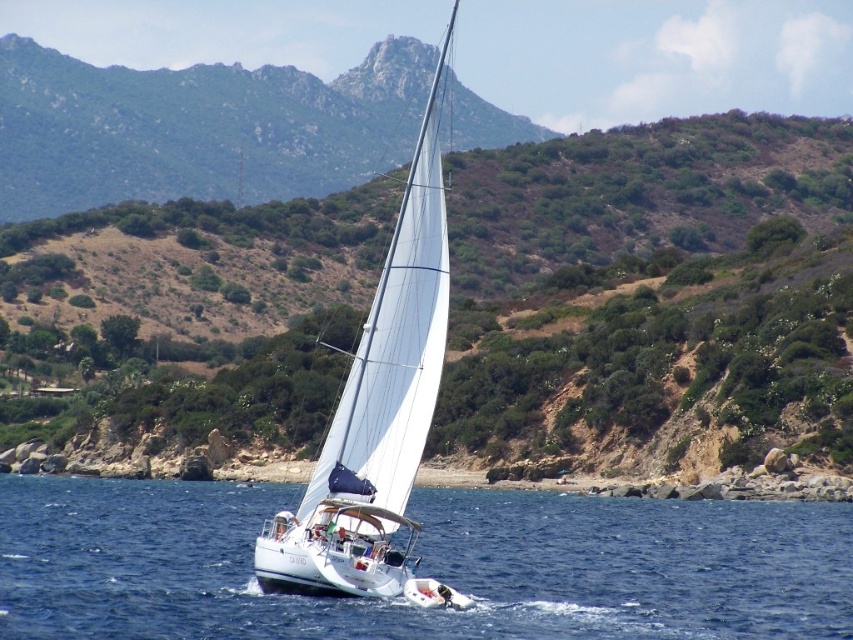
Can you confirm if green shrubbery at center is shorter than blue water at center?

No.

Is green shrubbery at center wider than blue water at center?

Indeed, green shrubbery at center has a greater width compared to blue water at center.

Locate an element on the screen. The image size is (853, 640). green shrubbery at center is located at coordinates (651, 300).

This screenshot has height=640, width=853. In order to click on green shrubbery at center in this screenshot , I will do `click(651, 300)`.

Which is below, blue water at center or white sailboat at center?

blue water at center is lower down.

Describe the element at coordinates (421, 564) in the screenshot. The width and height of the screenshot is (853, 640). I see `blue water at center` at that location.

Image resolution: width=853 pixels, height=640 pixels. I want to click on blue water at center, so click(421, 564).

Based on the photo, is green shrubbery at center to the left of white sailboat at center from the viewer's perspective?

In fact, green shrubbery at center is to the right of white sailboat at center.

Which is more to the left, green shrubbery at center or white sailboat at center?

white sailboat at center

You are a GUI agent. You are given a task and a screenshot of the screen. Output one action in this format:
    pyautogui.click(x=<x>, y=<y>)
    Task: Click on the green shrubbery at center
    The height and width of the screenshot is (640, 853).
    Given the screenshot: What is the action you would take?
    pyautogui.click(x=651, y=300)

You are a GUI agent. You are given a task and a screenshot of the screen. Output one action in this format:
    pyautogui.click(x=<x>, y=<y>)
    Task: Click on the green shrubbery at center
    
    Given the screenshot: What is the action you would take?
    pyautogui.click(x=651, y=300)